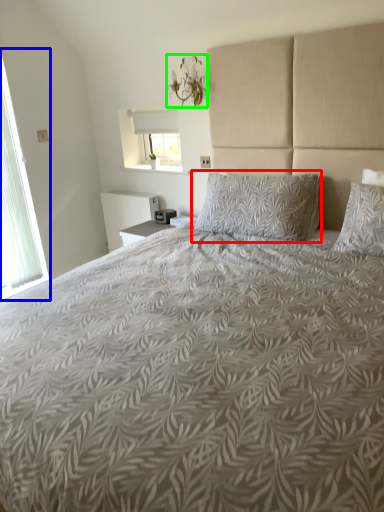
Question: Which object is positioned farthest from pillow (highlighted by a red box)? Select from window (highlighted by a blue box) and light fixture (highlighted by a green box).

Choices:
 (A) window
 (B) light fixture

Answer: (A)